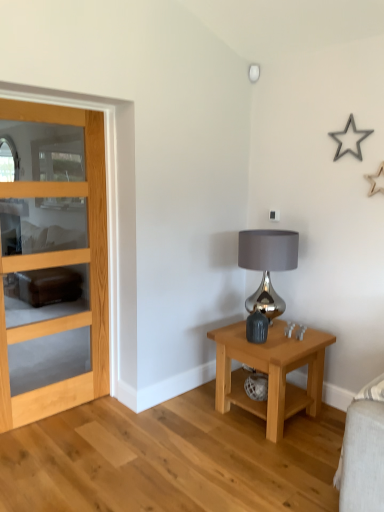
Question: Is satin silver lamp at upper center closer to the viewer compared to light wood/glass door at left?

Choices:
 (A) no
 (B) yes

Answer: (A)

Question: Is satin silver lamp at upper center bigger than light wood/glass door at left?

Choices:
 (A) yes
 (B) no

Answer: (B)

Question: From a real-world perspective, is satin silver lamp at upper center beneath light wood/glass door at left?

Choices:
 (A) yes
 (B) no

Answer: (B)

Question: From the image's perspective, is satin silver lamp at upper center beneath light wood/glass door at left?

Choices:
 (A) no
 (B) yes

Answer: (A)

Question: Is satin silver lamp at upper center not inside light wood/glass door at left?

Choices:
 (A) no
 (B) yes

Answer: (B)

Question: Is satin silver lamp at upper center further to camera compared to light wood/glass door at left?

Choices:
 (A) no
 (B) yes

Answer: (B)

Question: Would you say metallic gray lampshade at right is part of light wood/glass door at left's contents?

Choices:
 (A) no
 (B) yes

Answer: (A)

Question: Is light wood/glass door at left aimed at metallic gray lampshade at right?

Choices:
 (A) yes
 (B) no

Answer: (B)

Question: Does light wood/glass door at left appear on the right side of metallic gray lampshade at right?

Choices:
 (A) yes
 (B) no

Answer: (B)

Question: Does light wood/glass door at left have a lesser height compared to metallic gray lampshade at right?

Choices:
 (A) no
 (B) yes

Answer: (A)

Question: From the image's perspective, is light wood/glass door at left beneath metallic gray lampshade at right?

Choices:
 (A) no
 (B) yes

Answer: (A)

Question: From a real-world perspective, is light wood/glass door at left located beneath metallic gray lampshade at right?

Choices:
 (A) no
 (B) yes

Answer: (A)

Question: Does light wood/glass door at left lie behind light wood/finish nightstand at lower right?

Choices:
 (A) no
 (B) yes

Answer: (A)